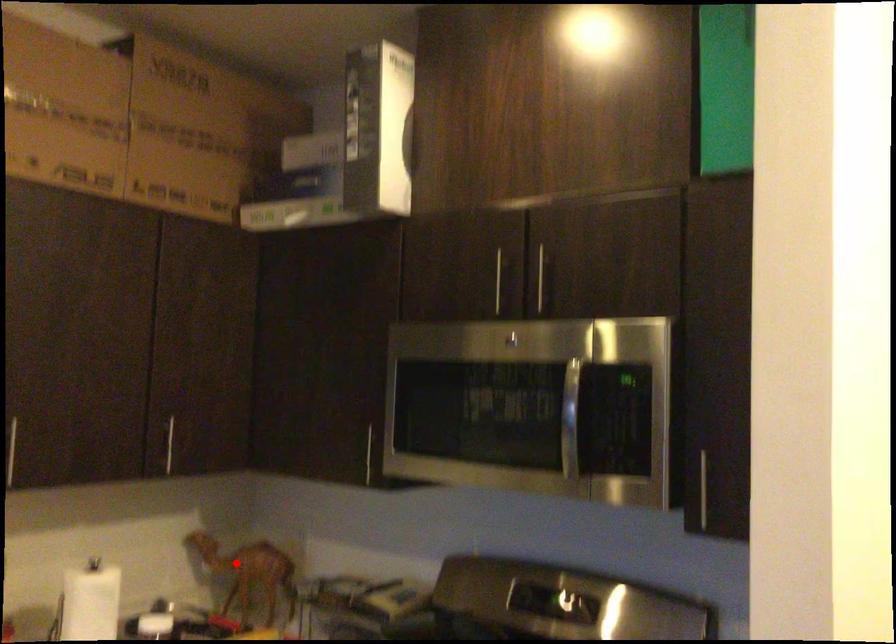
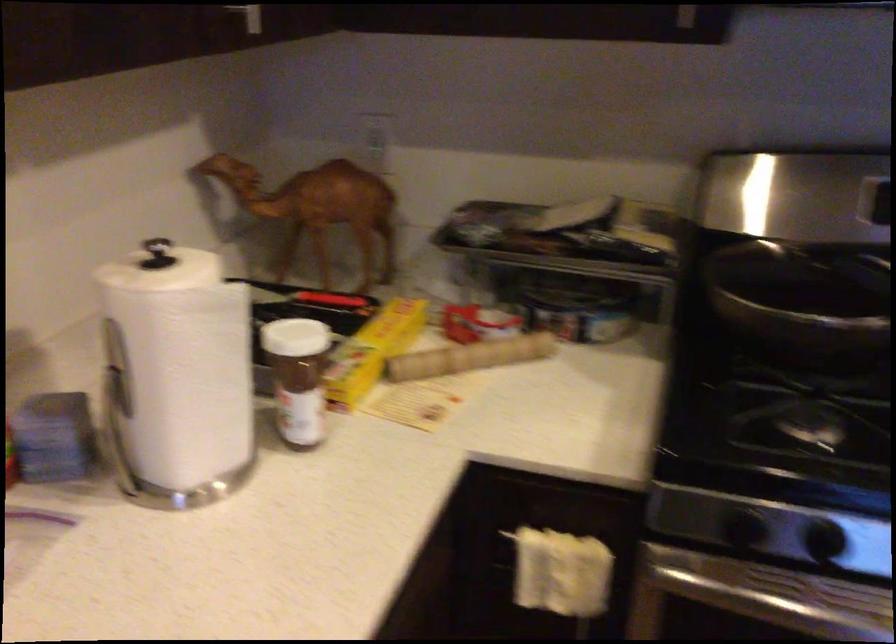
Question: I am providing you with two images of the same scene from different viewpoints. In image1, a red point is highlighted. Considering the same 3D point in image2, which of the following is correct?

Choices:
 (A) It is closer
 (B) It is farther

Answer: (A)